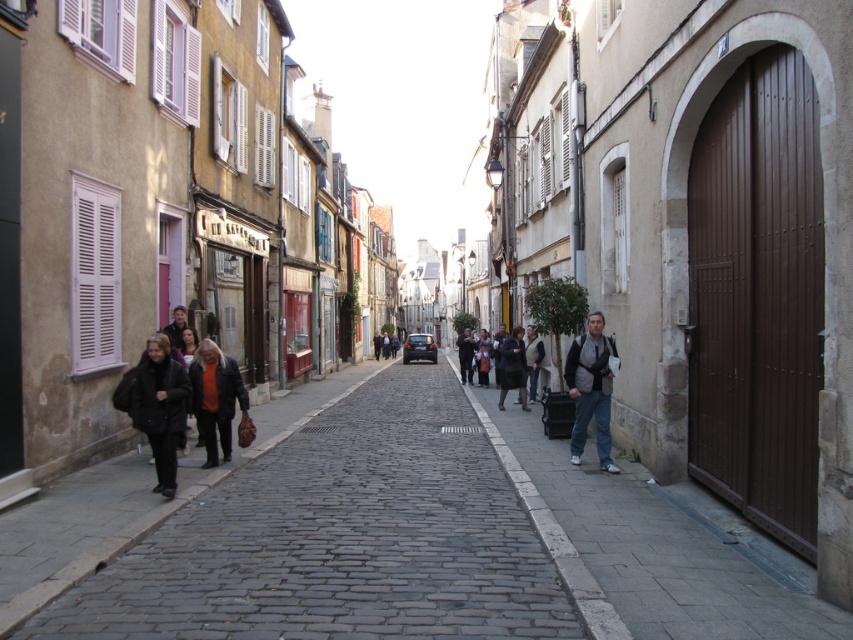
Is point (572, 458) closer to camera compared to point (500, 374)?

That is True.

Is gray fabric backpack at right to the left of dark brown leather coat at center from the viewer's perspective?

No, gray fabric backpack at right is not to the left of dark brown leather coat at center.

Between point (610, 381) and point (515, 339), which one is positioned in front?

Positioned in front is point (610, 381).

This screenshot has width=853, height=640. I want to click on gray fabric backpack at right, so click(590, 388).

Does black matte jacket at lower left come behind dark brown leather coat at center?

No, it is in front of dark brown leather coat at center.

Who is lower down, black matte jacket at lower left or dark brown leather coat at center?

black matte jacket at lower left is below.

I want to click on black matte jacket at lower left, so click(160, 406).

Does gray cobblestone pavement at center have a greater height compared to dark brown leather coat at center?

Incorrect, gray cobblestone pavement at center's height is not larger of dark brown leather coat at center's.

Is point (398, 435) farther from camera compared to point (502, 348)?

No, it is not.

Does point (473, 388) come in front of point (525, 378)?

No, it is behind (525, 378).

Identify the location of gray cobblestone pavement at center. The height and width of the screenshot is (640, 853). (296, 531).